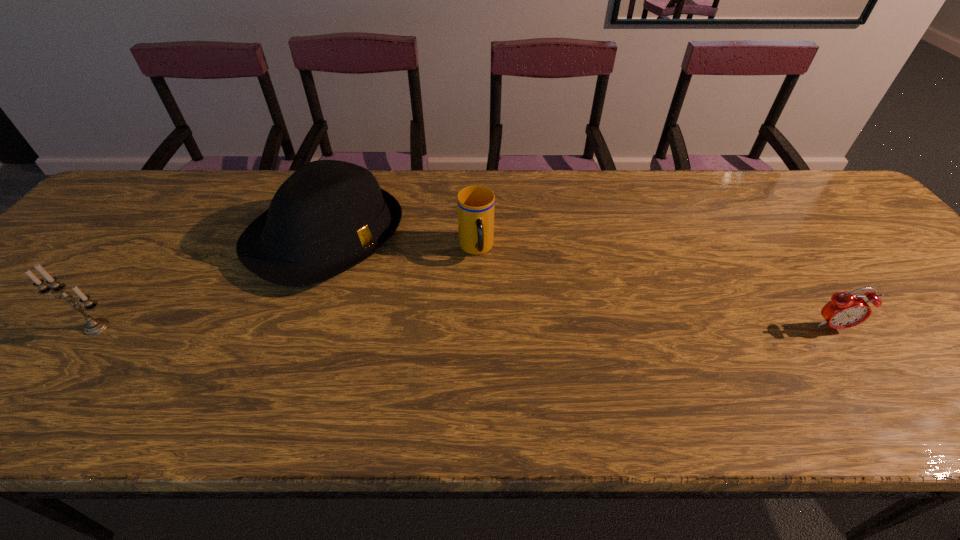
Locate an element on the screen. This screenshot has height=540, width=960. free space on the desktop that is between the candle and the rightmost object and is positioned on the side of the cup with the handle is located at coordinates (493, 327).

Where is `vacant space on the desktop that is between the leftmost object and the shortest object and is positioned on the front-facing side of the second object from left to right`? The width and height of the screenshot is (960, 540). vacant space on the desktop that is between the leftmost object and the shortest object and is positioned on the front-facing side of the second object from left to right is located at coordinates (479, 327).